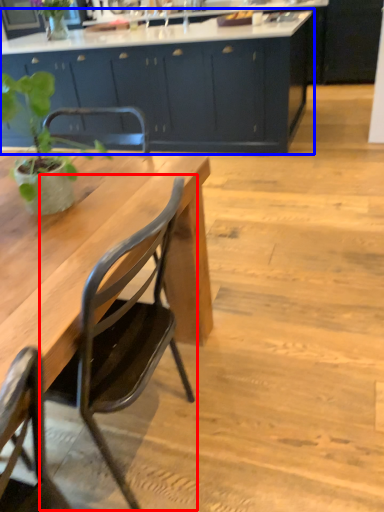
Question: Which of the following is the closest to the observer, chair (highlighted by a red box) or cabinetry (highlighted by a blue box)?

Choices:
 (A) chair
 (B) cabinetry

Answer: (A)